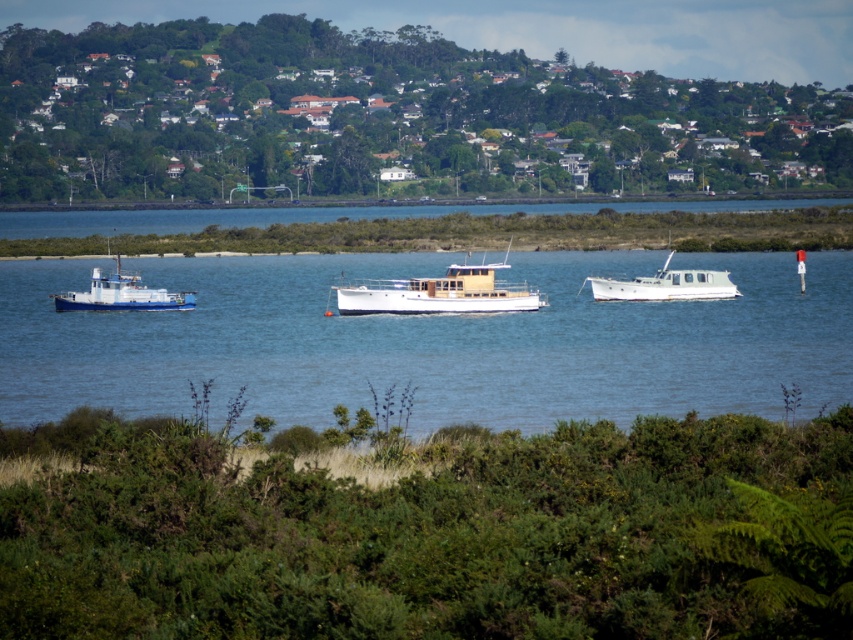
Question: Which object is farther from the camera taking this photo?

Choices:
 (A) blue metallic water at center
 (B) blue matte boat at left
 (C) wooden cabin cruiser at center

Answer: (B)

Question: Is white matte boat at center closer to the viewer compared to blue matte boat at left?

Choices:
 (A) no
 (B) yes

Answer: (A)

Question: Which of the following is the farthest from the observer?

Choices:
 (A) wooden cabin cruiser at center
 (B) blue matte boat at left
 (C) white matte boat at center
 (D) blue metallic water at center

Answer: (C)

Question: Can you confirm if wooden cabin cruiser at center is positioned below blue matte boat at left?

Choices:
 (A) no
 (B) yes

Answer: (A)

Question: Among these objects, which one is nearest to the camera?

Choices:
 (A) wooden cabin cruiser at center
 (B) white matte boat at center

Answer: (A)

Question: Does blue metallic water at center have a lesser width compared to blue matte boat at left?

Choices:
 (A) yes
 (B) no

Answer: (B)